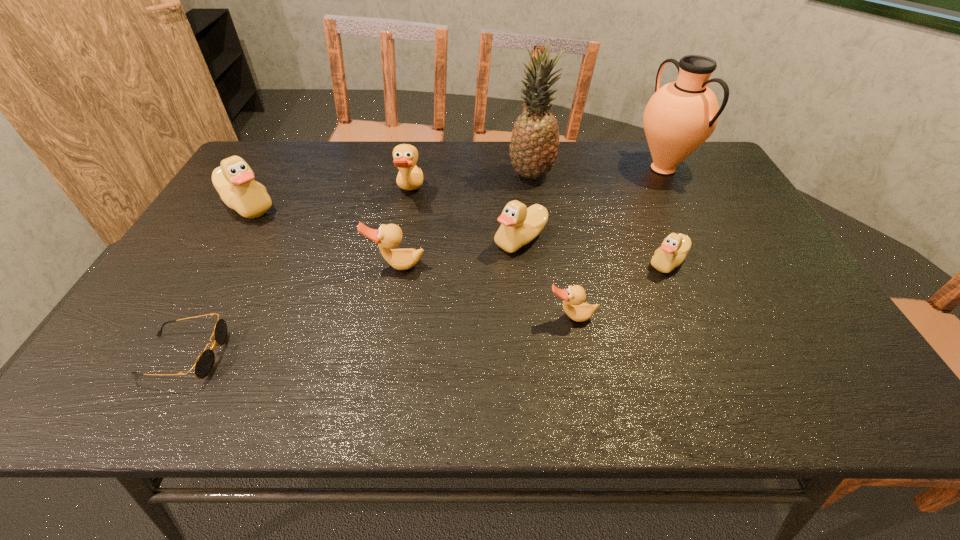
Find the location of a particular element. The image size is (960, 540). free space located on the beak of the second farthest tan duck is located at coordinates tap(374, 383).

I want to click on free space located at the beak of the smallest beige duck, so (x=536, y=262).

Find the location of a particular element. Image resolution: width=960 pixels, height=540 pixels. free space located 0.220m at the beak of the smallest beige duck is located at coordinates (560, 262).

This screenshot has height=540, width=960. Identify the location of blank space located 0.050m at the beak of the smallest beige duck. (627, 262).

Identify the location of free space located 0.130m on the beak of the smallest tan duck. (583, 377).

Find the location of `vacant position located 0.140m on the front-facing side of the nearest object`. vacant position located 0.140m on the front-facing side of the nearest object is located at coordinates (289, 355).

Locate an element on the screen. This screenshot has width=960, height=540. pineapple present at the far edge is located at coordinates (534, 144).

Locate an element on the screen. This screenshot has width=960, height=540. pitcher that is at the far edge is located at coordinates (680, 116).

Locate an element on the screen. The width and height of the screenshot is (960, 540). duck present at the far edge is located at coordinates (410, 177).

Where is `object situated at the near edge`? This screenshot has width=960, height=540. object situated at the near edge is located at coordinates (204, 364).